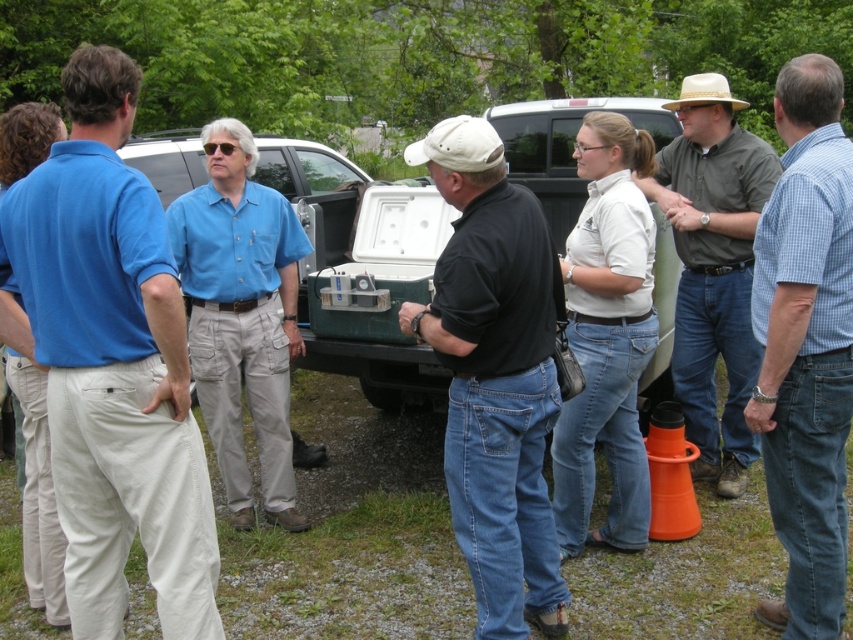
Question: In this image, where is matte blue shirt at center located relative to matte brown shirt at center?

Choices:
 (A) below
 (B) above

Answer: (A)

Question: Is blue checkered shirt at right in front of beige straw hat at upper right?

Choices:
 (A) yes
 (B) no

Answer: (A)

Question: Among these points, which one is farthest from the camera?

Choices:
 (A) (743, 292)
 (B) (776, 371)

Answer: (A)

Question: Which object is closer to the camera taking this photo?

Choices:
 (A) blue checkered shirt at right
 (B) matte blue truck at center
 (C) blue cotton shirt at left
 (D) matte brown shirt at center

Answer: (C)

Question: Considering the real-world distances, which object is closest to the green matte truck at center?

Choices:
 (A) matte blue shirt at center
 (B) beige straw hat at upper right

Answer: (A)

Question: Can you confirm if matte brown shirt at center is positioned below matte blue truck at center?

Choices:
 (A) no
 (B) yes

Answer: (B)